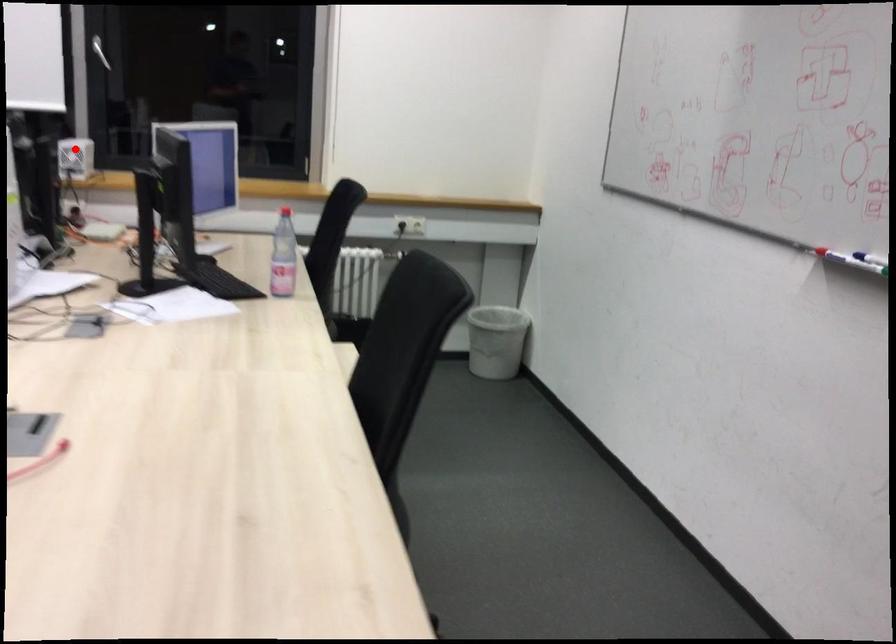
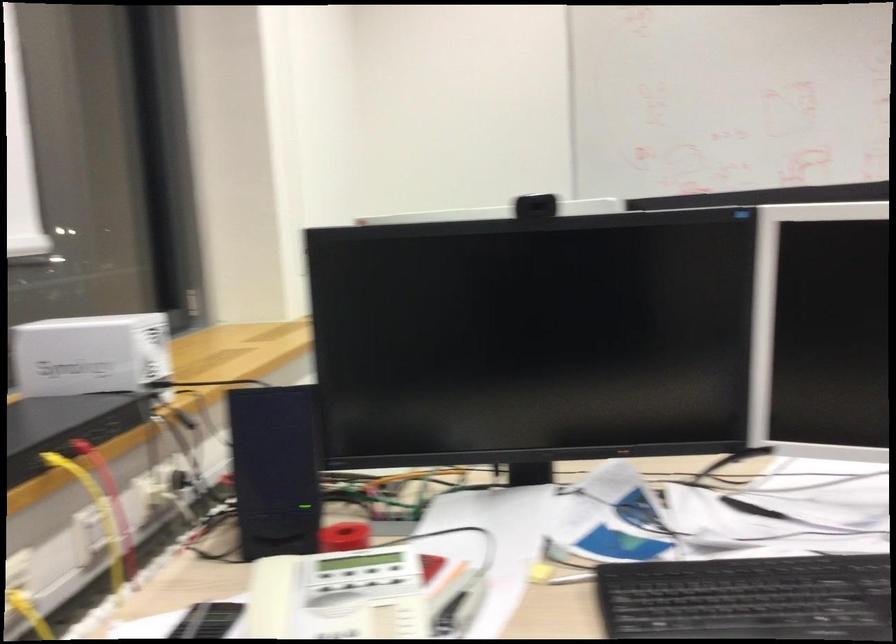
In the second image, find the point that corresponds to the highlighted location in the first image.

(90, 354)